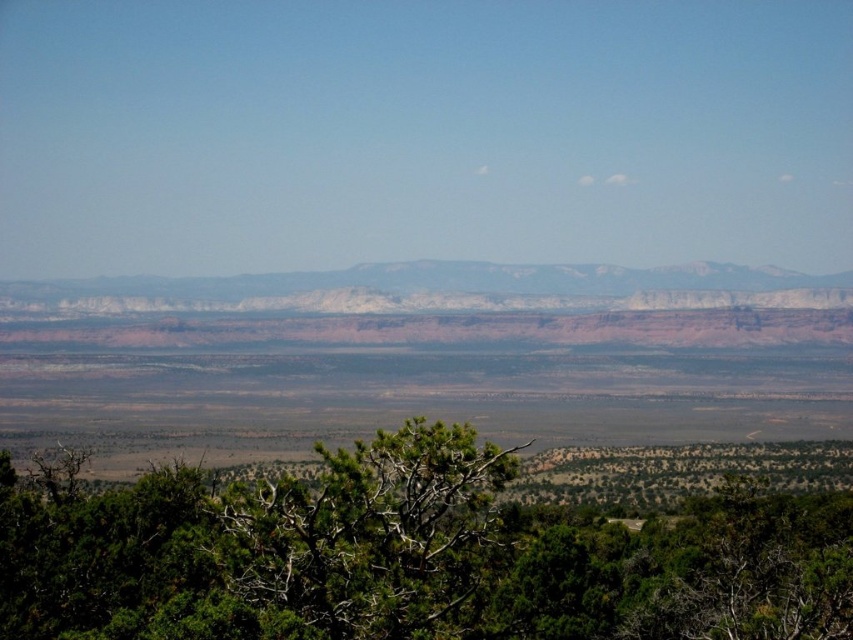
You are standing at the edge of the dense shrub area and want to walk towards the white sandstone mountains at center. Which direction should you go relative to the green leafy tree at center?

You should walk to the left of the green leafy tree at center because the white sandstone mountains at center are located to the left of the tree.

You are standing at the point with coordinates point (73, 460) and want to walk to the point with coordinates point (711, 285). Which direction should you move relative to your current position?

You should move backward because point (73, 460) is in front of point (711, 285), so to reach the latter, you need to go in the opposite direction.

You are a hiker standing at the base of the white sandstone mountains at center. You want to reach the green leafy tree at center. Which direction should you move relative to the mountains to get there?

The green leafy tree at center is located below the white sandstone mountains at center, so you should move downward towards the base of the mountains to reach it.